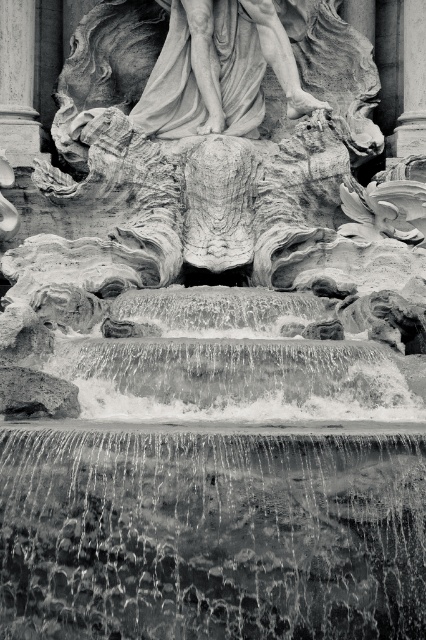
Based on the image, what is the 2D coordinate of the translucent water at center?

The 2D coordinate of the translucent water at center is at point (212, 536).

You are standing in front of the fountain and want to place a small statue between the smooth stone pillar at left and the smooth stone pillar at upper right. Based on their positions, where should you place the statue to ensure it is between them?

The smooth stone pillar at left is located below the smooth stone pillar at upper right, so placing the statue between them would require positioning it above the smooth stone pillar at left and below the smooth stone pillar at upper right.

You are standing in front of the fountain and want to know if the translucent water at center reaches the top of the smooth stone pillar at upper right. Based on the scene description, can you determine this?

The translucent water at center is shorter than the smooth stone pillar at upper right, so it does not reach the top of the smooth stone pillar at upper right.